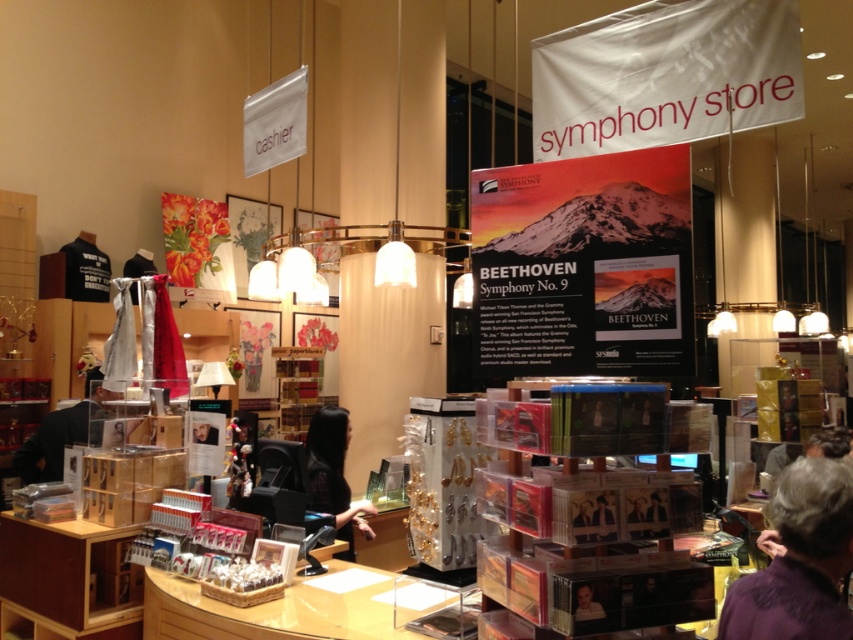
Question: Which of the following is the closest to the observer?

Choices:
 (A) (339, 422)
 (B) (585, 595)
 (C) (763, 602)

Answer: (B)

Question: Can you confirm if dark gray fabric at left is bigger than smooth skin portrait at lower right?

Choices:
 (A) yes
 (B) no

Answer: (A)

Question: Does purple fabric at lower right appear on the left side of black hair at cashier?

Choices:
 (A) no
 (B) yes

Answer: (A)

Question: Can you confirm if purple fabric at lower right is bigger than smooth skin portrait at lower right?

Choices:
 (A) no
 (B) yes

Answer: (B)

Question: Estimate the real-world distances between objects in this image. Which object is farther from the black hair at cashier?

Choices:
 (A) purple fabric at lower right
 (B) smooth skin portrait at lower right
 (C) dark gray fabric at left

Answer: (B)

Question: Which point is closer to the camera?

Choices:
 (A) purple fabric at lower right
 (B) dark gray fabric at left
 (C) black hair at cashier
 (D) smooth skin portrait at lower right

Answer: (A)